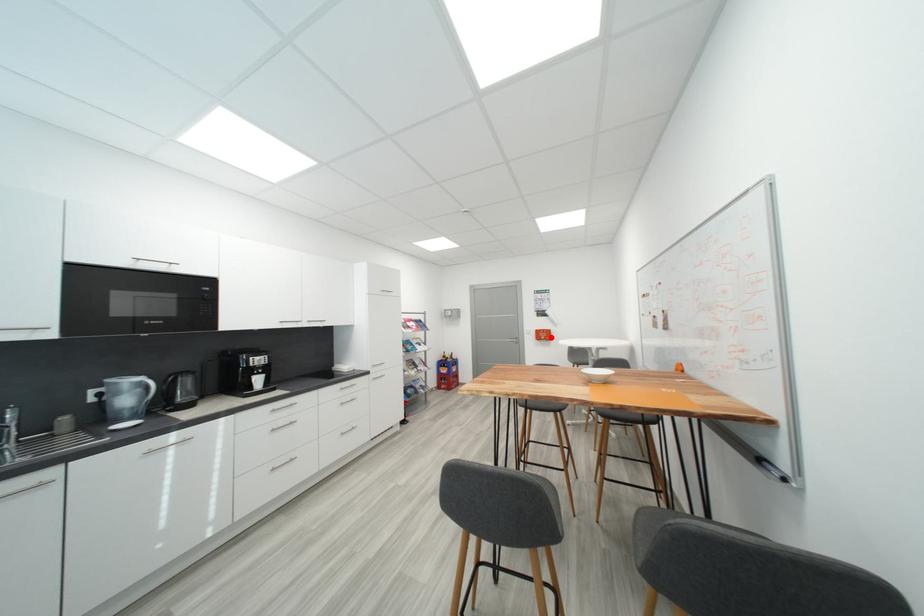
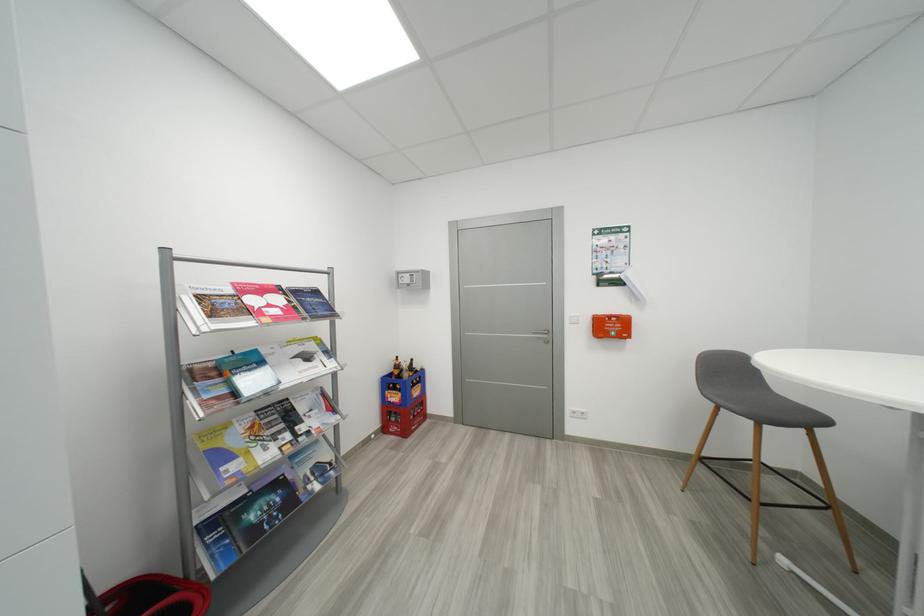
Question: I am providing you with two images of the same scene from different viewpoints. A red point is marked on the first image. Is the red point's position out of view in image 2?

Choices:
 (A) Yes
 (B) No

Answer: (B)